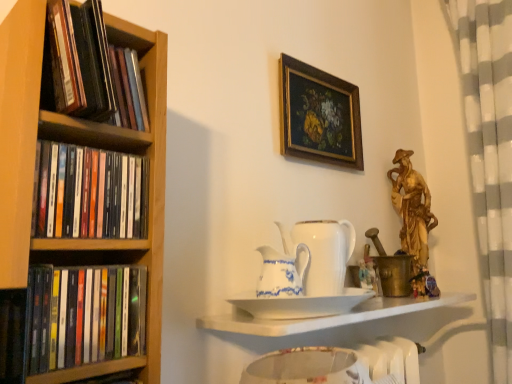
Question: Does white porcelain tea pot at center, the 2th tea pot in the back-to-front sequence, lie behind white porcelain teapot at center, which appears as the 2th tea pot when viewed from the front?

Choices:
 (A) no
 (B) yes

Answer: (A)

Question: Can you confirm if white porcelain tea pot at center, the 2th tea pot in the back-to-front sequence, is positioned to the right of white porcelain teapot at center, which appears as the 2th tea pot when viewed from the front?

Choices:
 (A) yes
 (B) no

Answer: (B)

Question: Considering the relative sizes of white porcelain tea pot at center, which is the first tea pot in front-to-back order, and white porcelain teapot at center, which appears as the 2th tea pot when viewed from the front, in the image provided, is white porcelain tea pot at center, which is the first tea pot in front-to-back order, taller than white porcelain teapot at center, which appears as the 2th tea pot when viewed from the front,?

Choices:
 (A) no
 (B) yes

Answer: (A)

Question: From the image's perspective, is white porcelain tea pot at center, the 2th tea pot in the back-to-front sequence, located beneath white porcelain teapot at center, which appears as the 2th tea pot when viewed from the front?

Choices:
 (A) no
 (B) yes

Answer: (B)

Question: Does white porcelain tea pot at center, the 2th tea pot in the back-to-front sequence, have a smaller size compared to white porcelain teapot at center, which appears as the 2th tea pot when viewed from the front?

Choices:
 (A) yes
 (B) no

Answer: (A)

Question: From a real-world perspective, does white porcelain tea pot at center, which is the first tea pot in front-to-back order, stand above white porcelain teapot at center, the 1th tea pot in the back-to-front sequence?

Choices:
 (A) yes
 (B) no

Answer: (B)

Question: Considering the relative sizes of black matte books at left, placed as the second book when sorted from bottom to top, and brass/metallic candle holder at right in the image provided, is black matte books at left, placed as the second book when sorted from bottom to top, shorter than brass/metallic candle holder at right?

Choices:
 (A) yes
 (B) no

Answer: (A)

Question: Does black matte books at left, positioned as the second book in top-to-bottom order, come behind brass/metallic candle holder at right?

Choices:
 (A) no
 (B) yes

Answer: (A)

Question: Is black matte books at left, positioned as the second book in top-to-bottom order, at the left side of brass/metallic candle holder at right?

Choices:
 (A) yes
 (B) no

Answer: (A)

Question: Considering the relative sizes of black matte books at left, positioned as the second book in top-to-bottom order, and brass/metallic candle holder at right in the image provided, is black matte books at left, positioned as the second book in top-to-bottom order, smaller than brass/metallic candle holder at right?

Choices:
 (A) no
 (B) yes

Answer: (B)

Question: From the image's perspective, does black matte books at left, placed as the second book when sorted from bottom to top, appear lower than brass/metallic candle holder at right?

Choices:
 (A) yes
 (B) no

Answer: (B)

Question: Is black matte books at left, placed as the second book when sorted from bottom to top, taller than brass/metallic candle holder at right?

Choices:
 (A) no
 (B) yes

Answer: (A)

Question: Is the surface of black matte bookshelf at left, the 1th book viewed from the top, in direct contact with black matte book at left, arranged as the 3th book when viewed from the top?

Choices:
 (A) yes
 (B) no

Answer: (B)